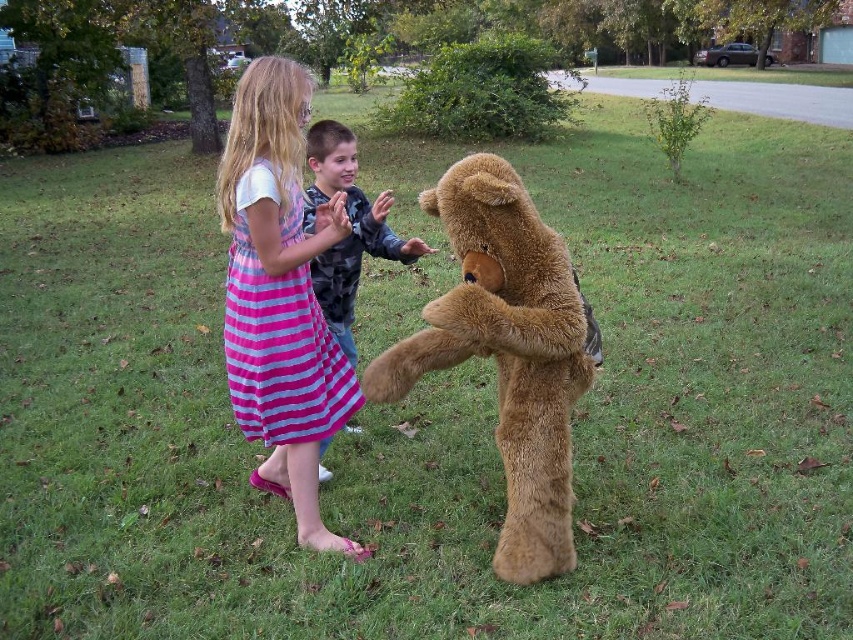
From the picture: You are a photographer trying to capture a clear shot of both the pink striped dress at center and the camouflage jacket at center. Since you can only focus on one subject at a time, which one should you focus on to ensure the other is still somewhat in focus?

The photographer should focus on the pink striped dress at center because it is in front of the camouflage jacket at center. By focusing on the closer subject, the background subject will still be somewhat in focus due to the depth of field.

You are standing at the origin point looking at the two points in the image. Which point, point (514, 520) or point (343, 160), is closer to you?

Point (514, 520) is closer to the viewer than point (343, 160).

In the image, there is a girl wearing a pink and blue striped dress at center and a boy in a camouflage jacket standing behind her. If you were to draw a straight line from the point at coordinates (x=280, y=294) to the teddy bear, would this line pass through the boy in the camouflage jacket?

The point at coordinates (x=280, y=294) corresponds to the pink striped dress at center. Since the boy in the camouflage jacket is standing behind the girl wearing the pink and blue striped dress at center, the line drawn from the point to the teddy bear would pass through the boy in the camouflage jacket.